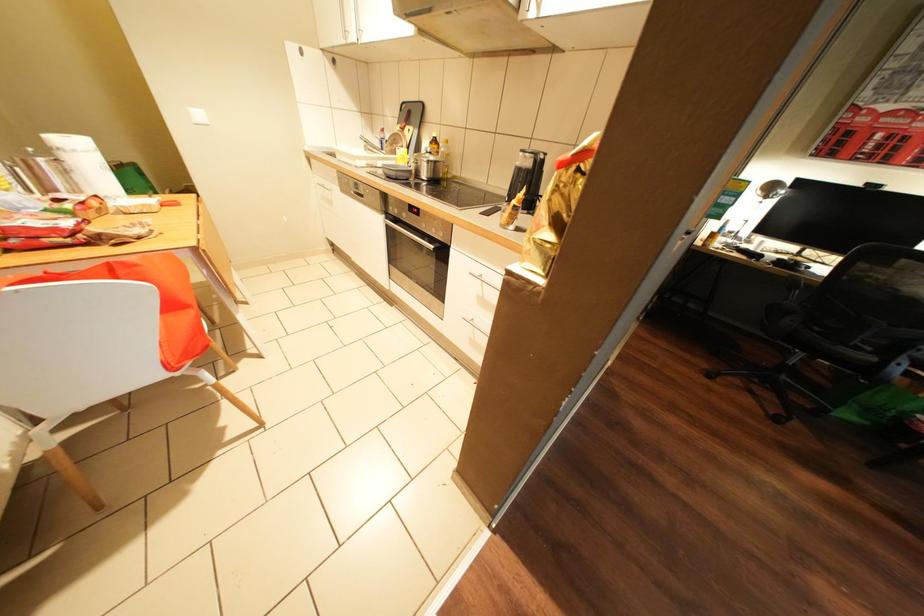
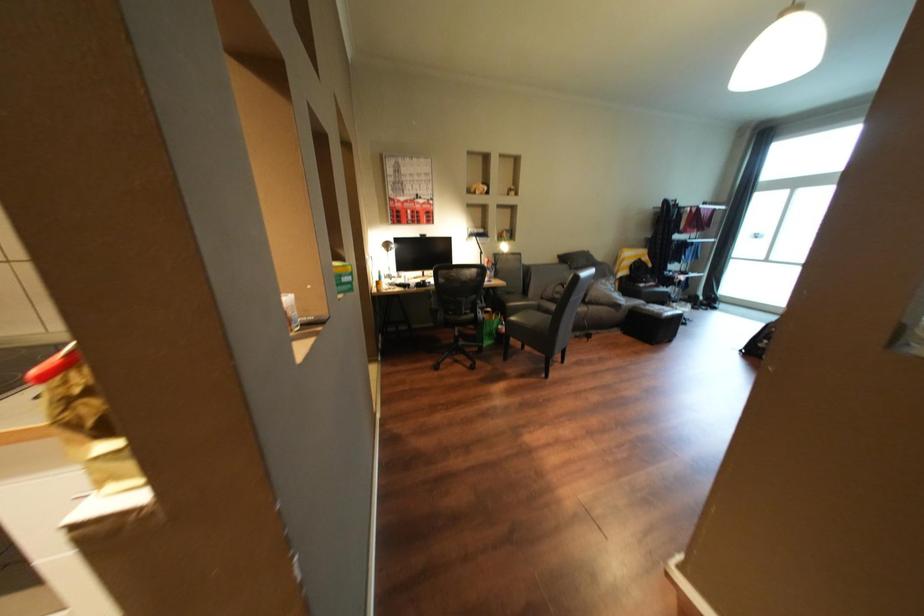
Question: The first image is from the beginning of the video and the second image is from the end. How did the camera likely rotate when shooting the video?

Choices:
 (A) Left
 (B) Right
 (C) Up
 (D) Down

Answer: (B)